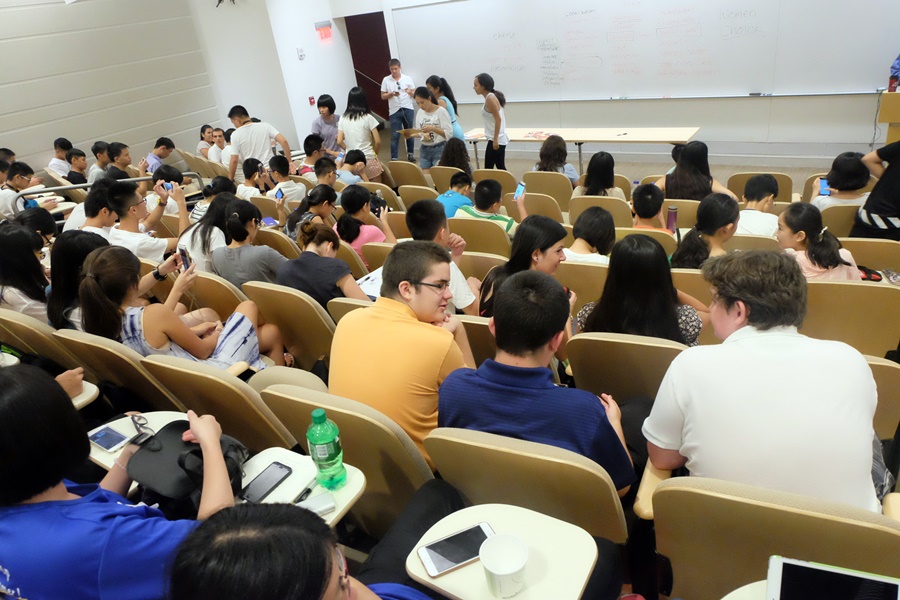
Where is `door`? The image size is (900, 600). door is located at coordinates (364, 51).